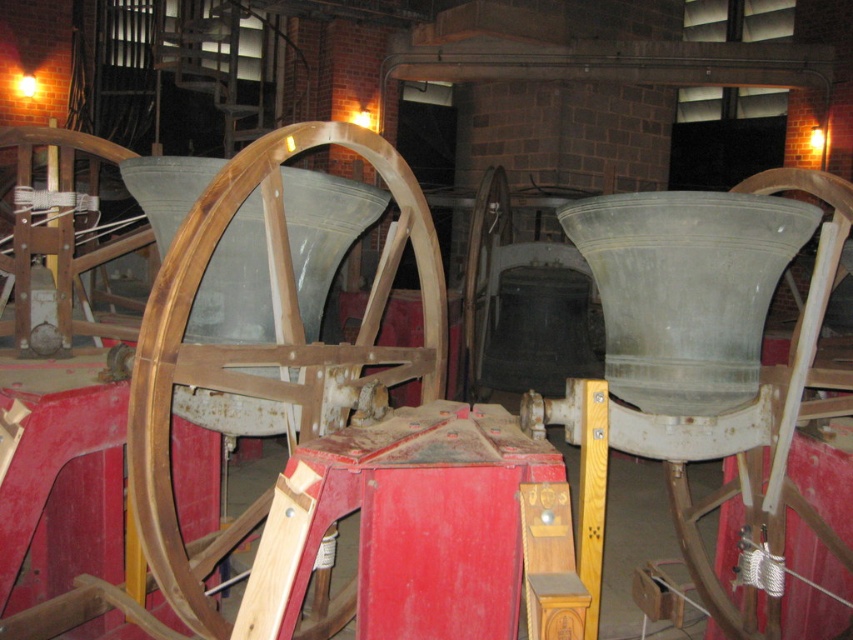
Question: Which point is closer to the camera?

Choices:
 (A) wooden at center
 (B) wooden wheel at center
 (C) metallic gray bell at center

Answer: (B)

Question: Which point is farther to the camera?

Choices:
 (A) wooden wheel at center
 (B) metallic gray bell at center

Answer: (B)

Question: Does metallic gray bell at center have a greater width compared to wooden at center?

Choices:
 (A) yes
 (B) no

Answer: (A)

Question: Considering the relative positions of metallic gray bell at center and wooden at center in the image provided, where is metallic gray bell at center located with respect to wooden at center?

Choices:
 (A) right
 (B) left

Answer: (A)

Question: Which of the following is the farthest from the observer?

Choices:
 (A) wooden at center
 (B) wooden wheel at center
 (C) metallic gray bell at center

Answer: (A)

Question: Can you confirm if metallic gray bell at center is positioned to the right of wooden at center?

Choices:
 (A) yes
 (B) no

Answer: (A)